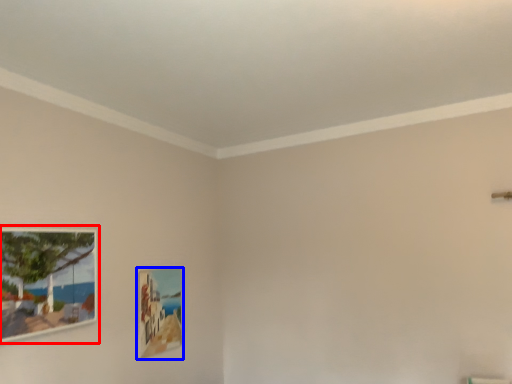
Question: Which of the following is the closest to the observer, picture frame (highlighted by a red box) or picture frame (highlighted by a blue box)?

Choices:
 (A) picture frame
 (B) picture frame

Answer: (A)